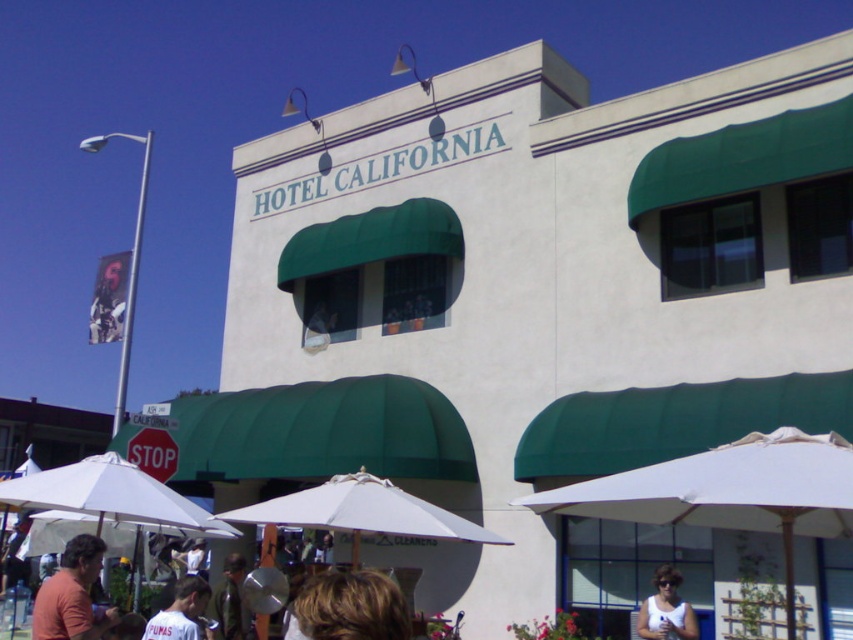
Question: Does white fabric umbrella at lower left have a smaller size compared to red matte stop sign at center?

Choices:
 (A) yes
 (B) no

Answer: (B)

Question: Based on their relative distances, which object is farther from the white fabric umbrella at lower right?

Choices:
 (A) white fabric umbrella at lower left
 (B) white fabric umbrella at center
 (C) red matte stop sign at center

Answer: (C)

Question: Estimate the real-world distances between objects in this image. Which object is farther from the red matte stop sign at center?

Choices:
 (A) white cotton shirt at lower left
 (B) white fabric umbrella at lower right
 (C) blonde hair at lower center

Answer: (C)

Question: Does white fabric umbrella at lower left have a larger size compared to orange t-shirt at lower left?

Choices:
 (A) no
 (B) yes

Answer: (A)

Question: Is white fabric umbrella at lower right to the left of blonde hair at lower center from the viewer's perspective?

Choices:
 (A) no
 (B) yes

Answer: (A)

Question: Which point appears farthest from the camera in this image?

Choices:
 (A) (138, 429)
 (B) (62, 618)
 (C) (387, 600)
 (D) (51, 476)

Answer: (A)